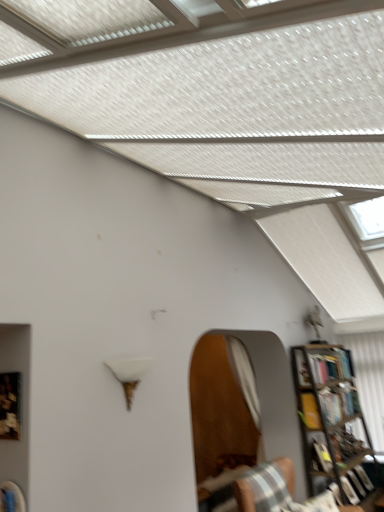
Question: Does hardcover book at right have a larger size compared to white fabric curtain at right?

Choices:
 (A) no
 (B) yes

Answer: (A)

Question: From the image's perspective, is hardcover book at right below white fabric curtain at right?

Choices:
 (A) no
 (B) yes

Answer: (A)

Question: Is hardcover book at right to the right of white fabric curtain at right from the viewer's perspective?

Choices:
 (A) yes
 (B) no

Answer: (B)

Question: Can you confirm if hardcover book at right is taller than white fabric curtain at right?

Choices:
 (A) yes
 (B) no

Answer: (B)

Question: Is hardcover book at right further to the viewer compared to white fabric curtain at right?

Choices:
 (A) no
 (B) yes

Answer: (A)

Question: Is white fabric curtain at right at the back of hardcover book at right?

Choices:
 (A) no
 (B) yes

Answer: (A)

Question: Is white fabric curtain at right positioned behind hardcover book at right?

Choices:
 (A) no
 (B) yes

Answer: (B)

Question: Can you confirm if white fabric curtain at right is positioned to the left of hardcover book at right?

Choices:
 (A) yes
 (B) no

Answer: (B)

Question: From a real-world perspective, does white fabric curtain at right sit lower than hardcover book at right?

Choices:
 (A) no
 (B) yes

Answer: (A)

Question: Would you say white fabric curtain at right contains hardcover book at right?

Choices:
 (A) yes
 (B) no

Answer: (B)

Question: Considering the relative sizes of white fabric curtain at right and hardcover book at right in the image provided, is white fabric curtain at right bigger than hardcover book at right?

Choices:
 (A) no
 (B) yes

Answer: (B)

Question: Can you confirm if white fabric curtain at right is shorter than hardcover book at right?

Choices:
 (A) no
 (B) yes

Answer: (A)

Question: From a real-world perspective, is striped fabric chair at lower right positioned over metallic bookcase at right based on gravity?

Choices:
 (A) no
 (B) yes

Answer: (A)